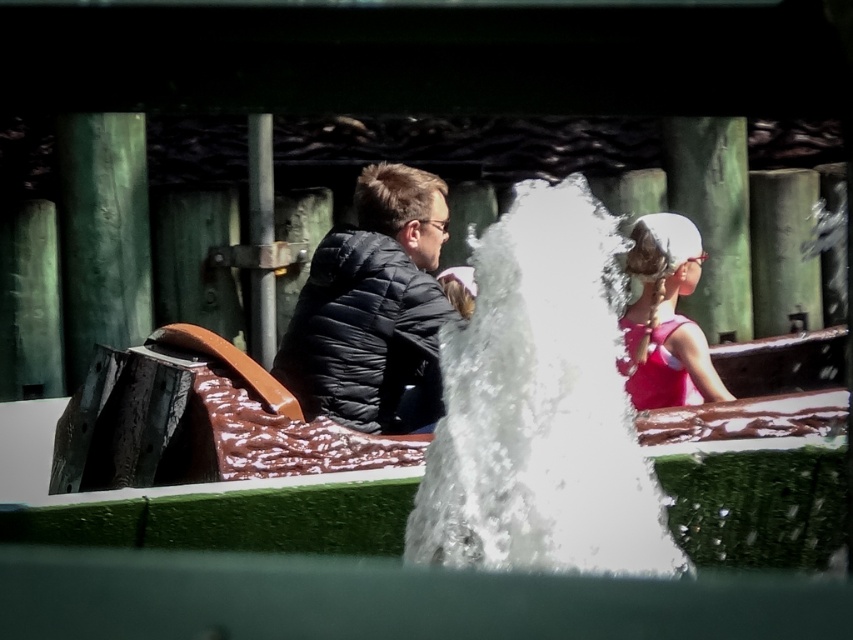
Question: Which of the following is the closest to the observer?

Choices:
 (A) (305, 291)
 (B) (379, 291)
 (C) (497, 291)
 (D) (706, 358)

Answer: (C)

Question: Does white frothy water at center lie behind black puffer jacket at center?

Choices:
 (A) no
 (B) yes

Answer: (A)

Question: Which object is farther from the camera taking this photo?

Choices:
 (A) black puffer jacket at center
 (B) pink fabric hair at upper right

Answer: (B)

Question: Is white frothy water at center above pink fabric hair at upper right?

Choices:
 (A) yes
 (B) no

Answer: (B)

Question: Does white frothy water at center lie behind black puffer jacket at center?

Choices:
 (A) yes
 (B) no

Answer: (B)

Question: Which object appears farthest from the camera in this image?

Choices:
 (A) matte black jacket at center
 (B) pink fabric hair at upper right

Answer: (B)